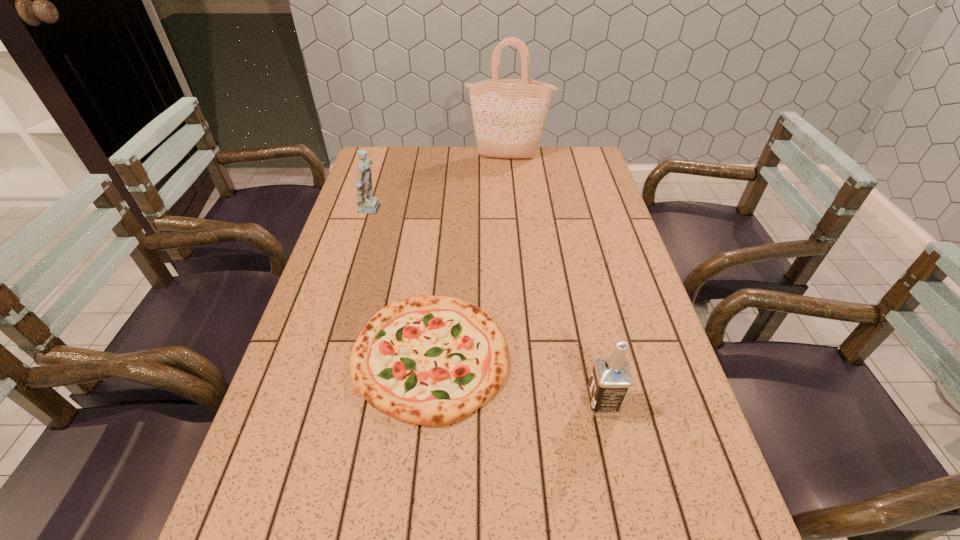
Locate an element on the screen. shopping bag is located at coordinates (508, 114).

The height and width of the screenshot is (540, 960). What are the coordinates of `the farthest object` in the screenshot? It's located at (508, 114).

Locate an element on the screen. This screenshot has width=960, height=540. the second farthest object is located at coordinates point(366,202).

Locate an element on the screen. the leftmost object is located at coordinates (366, 202).

The height and width of the screenshot is (540, 960). What are the coordinates of `vodka` in the screenshot? It's located at (610, 380).

In order to click on the shortest object in this screenshot , I will do pyautogui.click(x=430, y=360).

Find the location of a particular element. The image size is (960, 540). vacant space located 0.050m on the left of the farthest object is located at coordinates (453, 158).

The height and width of the screenshot is (540, 960). In order to click on vacant space positioned 0.240m on the front-facing side of the second farthest object in this screenshot , I will do `click(461, 211)`.

The image size is (960, 540). Identify the location of vacant space situated on the front label of the vodka. (471, 403).

Image resolution: width=960 pixels, height=540 pixels. In order to click on vacant space situated 0.080m on the front label of the vodka in this screenshot , I will do `click(548, 403)`.